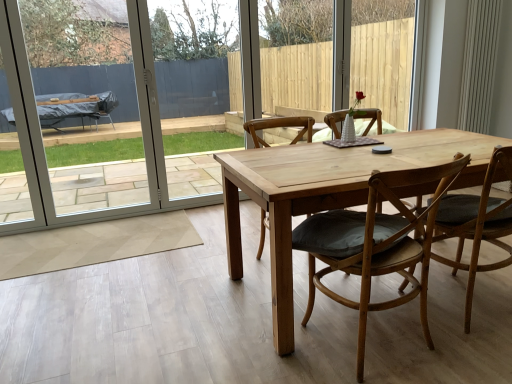
I want to click on free space that is to the left of wooden chair with cushion at center, the second chair from the right, so click(247, 349).